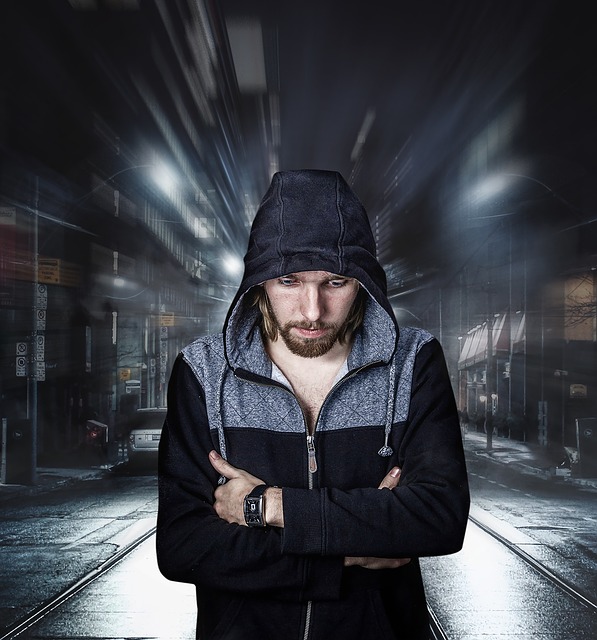
In order to click on chest in this screenshot , I will do `click(312, 368)`.